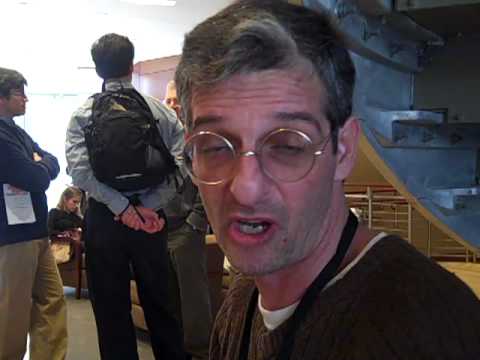
At what (x,y) coordinates should I click in order to perform the action: click on chair. Please return your answer as a coordinate pair (x, y). Looking at the image, I should click on (137, 314), (72, 274).